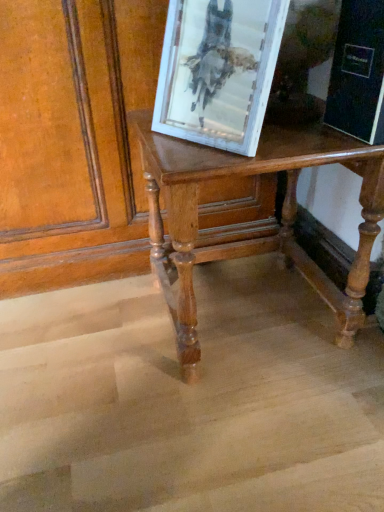
Find the location of a particular element. This screenshot has height=512, width=384. unoccupied region to the right of white distressed wood picture frame at upper center is located at coordinates (294, 139).